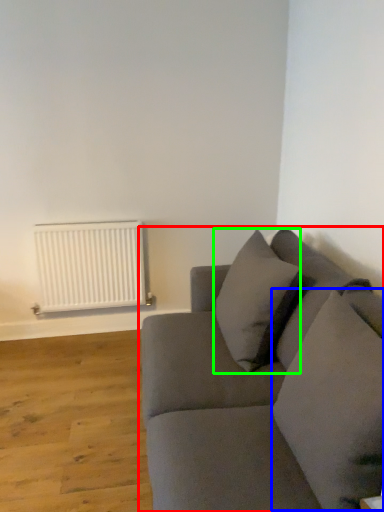
Question: Which is farther away from studio couch (highlighted by a red box)? pillow (highlighted by a blue box) or pillow (highlighted by a green box)?

Choices:
 (A) pillow
 (B) pillow

Answer: (B)